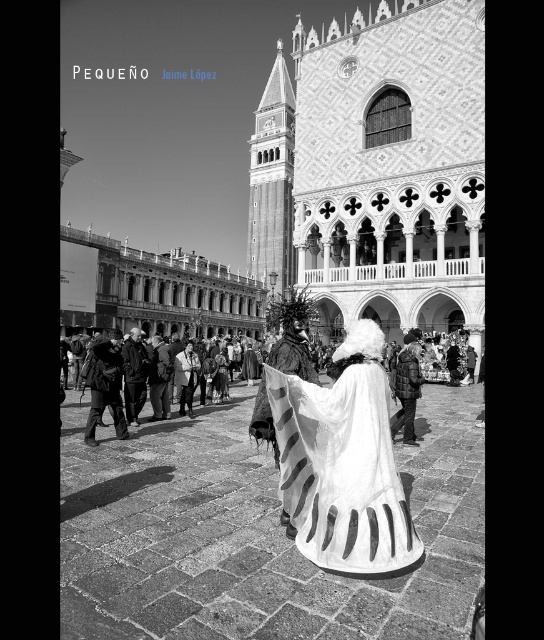
Is polished stone palace at center above white textured cape at center?

Indeed, polished stone palace at center is positioned over white textured cape at center.

What do you see at coordinates (376, 168) in the screenshot? I see `polished stone palace at center` at bounding box center [376, 168].

Does point (363, 268) come behind point (286, 522)?

Yes, it is behind point (286, 522).

This screenshot has width=544, height=640. Find the location of `polished stone palace at center`. polished stone palace at center is located at coordinates (376, 168).

Is white matte dress at center wider than white textured cape at center?

Correct, the width of white matte dress at center exceeds that of white textured cape at center.

The width and height of the screenshot is (544, 640). What do you see at coordinates (342, 470) in the screenshot?
I see `white matte dress at center` at bounding box center [342, 470].

What are the coordinates of `white matte dress at center` in the screenshot? It's located at (342, 470).

Which is more to the right, white matte dress at center or white fur coat at center?

white matte dress at center is more to the right.

Which is behind, point (329, 458) or point (127, 419)?

The point (127, 419) is more distant.

Measure the distance between white matte dress at center and camera.

white matte dress at center is 26.29 meters from camera.

Locate an element on the screen. The image size is (544, 640). white matte dress at center is located at coordinates (342, 470).